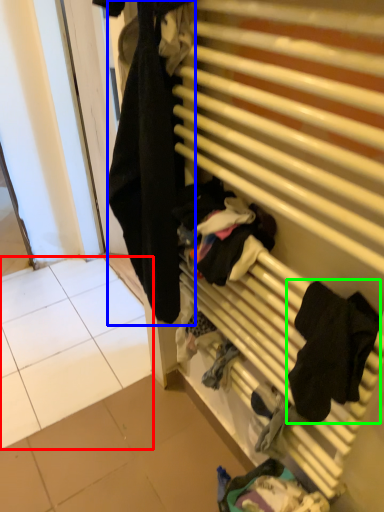
Question: Which object is positioned closest to tile (highlighted by a red box)? Select from clothing (highlighted by a blue box) and clothing (highlighted by a green box).

Choices:
 (A) clothing
 (B) clothing

Answer: (A)